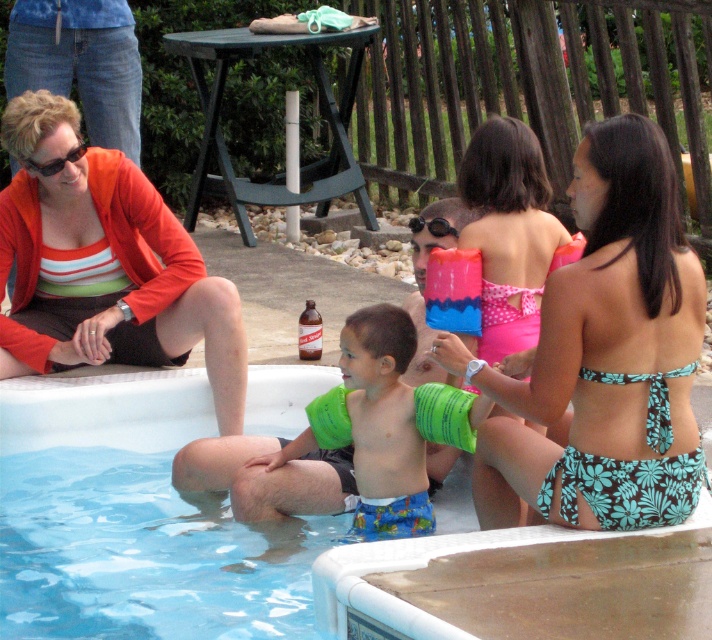
Question: Which point is closer to the camera?

Choices:
 (A) green rubber arm bands at center
 (B) blue plastic pool at center

Answer: (B)

Question: Does floral bikini at center lie behind green rubber arm bands at lower center?

Choices:
 (A) yes
 (B) no

Answer: (B)

Question: Among these points, which one is farthest from the camera?

Choices:
 (A) (367, 339)
 (B) (543, 225)

Answer: (B)

Question: Is floral bikini at center below orange fabric jacket at upper left?

Choices:
 (A) no
 (B) yes

Answer: (B)

Question: Can you confirm if green rubber arm bands at lower center is positioned to the left of black rubber goggles at center?

Choices:
 (A) no
 (B) yes

Answer: (B)

Question: Which of the following is the closest to the observer?

Choices:
 (A) (194, 326)
 (B) (130, 346)
 (C) (197, 538)
 (D) (350, 316)

Answer: (C)